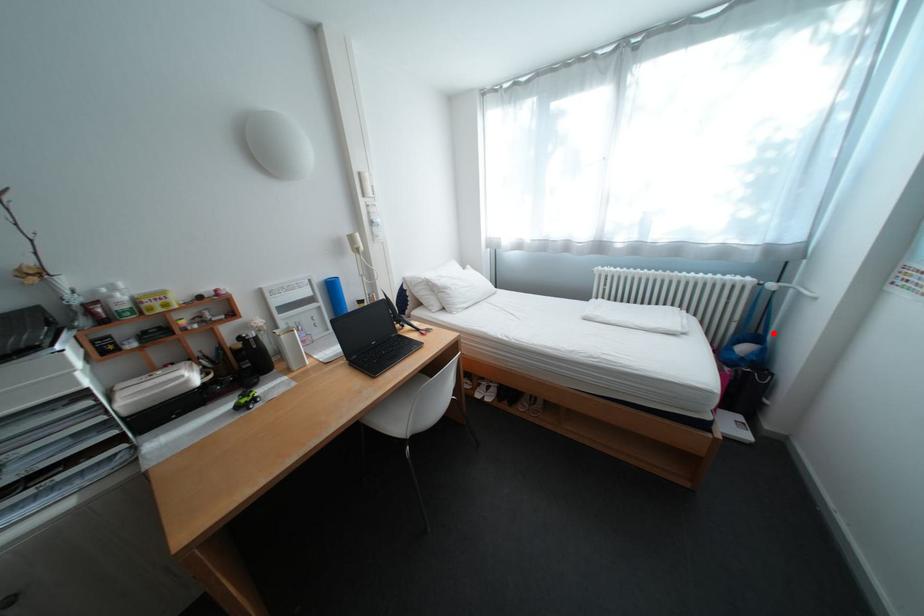
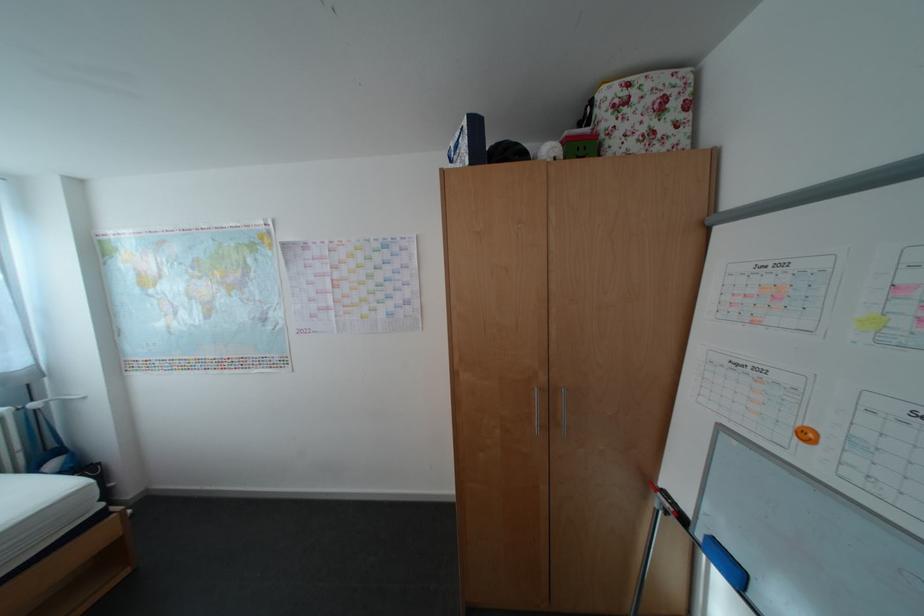
Where in the second image is the point corresponding to the highlighted location from the first image?

(67, 447)